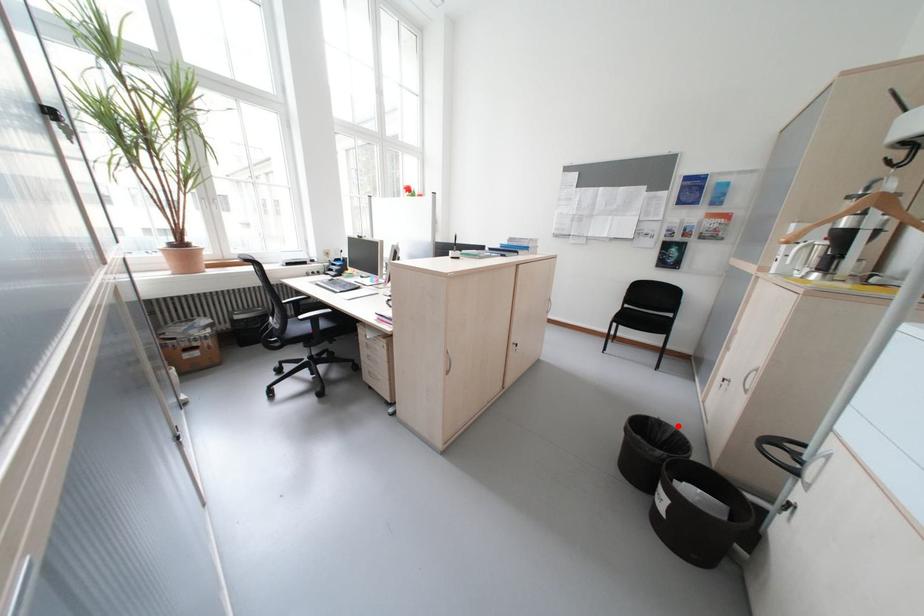
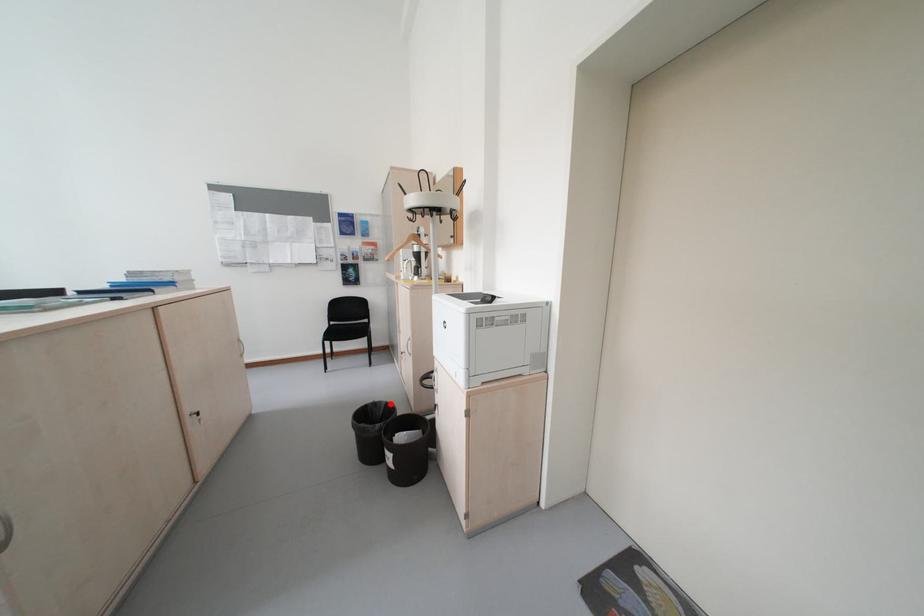
I am providing you with two images of the same scene from different viewpoints. A red point is marked on the first image and another point is marked on the second image. Is the marked point in image1 the same physical position as the marked point in image2?

Yes